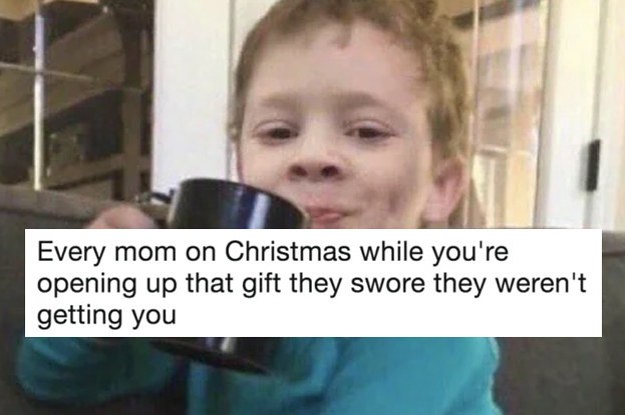
I want to click on window, so click(x=21, y=43), click(x=17, y=157), click(x=121, y=75), click(x=112, y=120), click(x=508, y=57), click(x=494, y=164), click(x=454, y=11), click(x=457, y=221).